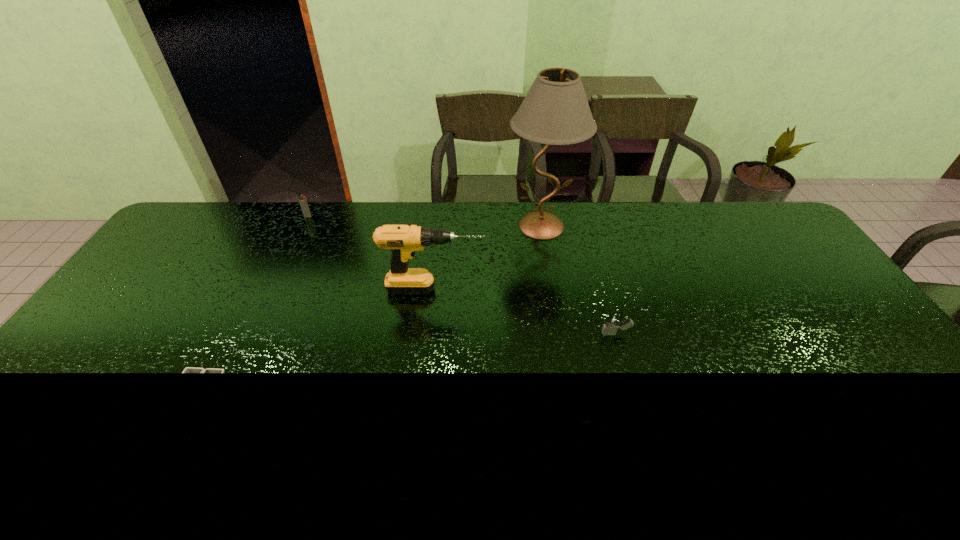
At what (x,y) coordinates should I click in order to perform the action: click on free region located on the front of the left igniter. Please return your answer as a coordinate pair (x, y). This screenshot has width=960, height=540. Looking at the image, I should click on (284, 266).

Image resolution: width=960 pixels, height=540 pixels. Find the location of `vacant space situated on the right of the fourth farthest object`. vacant space situated on the right of the fourth farthest object is located at coordinates (652, 334).

Find the location of a particular element. The image size is (960, 540). blank space located 0.220m on the left of the ashtray is located at coordinates (89, 392).

The image size is (960, 540). Identify the location of table lamp located in the far edge section of the desktop. (555, 111).

Identify the location of igniter that is positioned at the far edge. The image size is (960, 540). (302, 200).

In the image, there is a desktop. What are the coordinates of `vacant space at the far edge` in the screenshot? It's located at (593, 241).

You are a GUI agent. You are given a task and a screenshot of the screen. Output one action in this format:
    pyautogui.click(x=<x>, y=<y>)
    Task: Click on the free region at the near edge
    
    Given the screenshot: What is the action you would take?
    pyautogui.click(x=882, y=462)

I want to click on free space at the left edge of the desktop, so click(x=39, y=420).

You are a GUI agent. You are given a task and a screenshot of the screen. Output one action in this format:
    pyautogui.click(x=<x>, y=<y>)
    Task: Click on the vacant region at the right edge of the desktop
    
    Given the screenshot: What is the action you would take?
    pyautogui.click(x=841, y=353)

At what (x,y) coordinates should I click in order to perform the action: click on vacant space at the far right corner. Please return your answer as a coordinate pair (x, y). The height and width of the screenshot is (540, 960). Looking at the image, I should click on (776, 237).